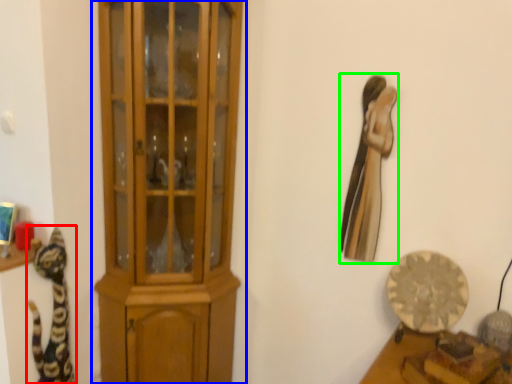
Question: Based on their relative distances, which object is nearer to cat (highlighted by a red box)? Choose from cupboard (highlighted by a blue box) and animal (highlighted by a green box).

Choices:
 (A) cupboard
 (B) animal

Answer: (A)